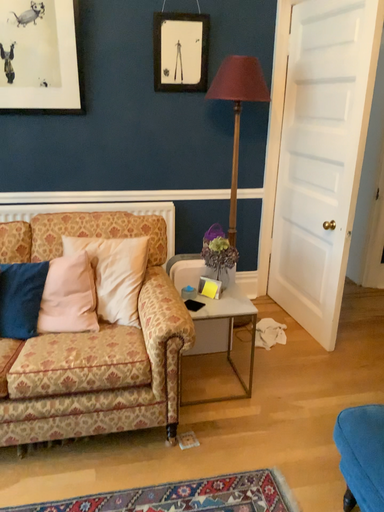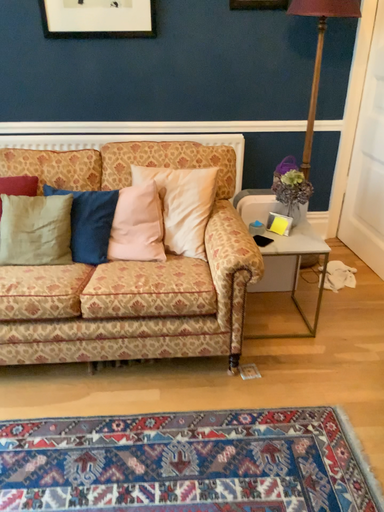
Question: How did the camera likely rotate when shooting the video?

Choices:
 (A) rotated upward
 (B) rotated downward

Answer: (B)